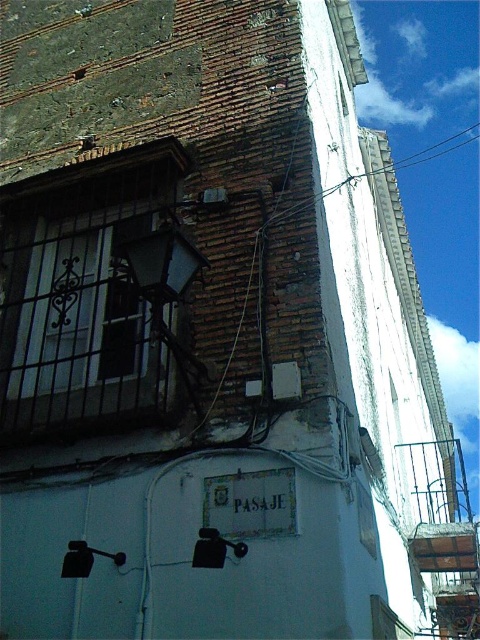
Question: Can you confirm if brown wire at center is positioned to the left of white plastic power line at upper center?

Choices:
 (A) yes
 (B) no

Answer: (B)

Question: Which point is closer to the camera?

Choices:
 (A) brown wire at center
 (B) white plastic power line at upper center

Answer: (A)

Question: Is brown wire at center positioned at the back of white plastic power line at upper center?

Choices:
 (A) yes
 (B) no

Answer: (B)

Question: Which point is closer to the camera taking this photo?

Choices:
 (A) (435, 432)
 (B) (447, 147)

Answer: (A)

Question: Which object is closer to the camera taking this photo?

Choices:
 (A) brown wire at center
 (B) white plastic power line at upper center

Answer: (A)

Question: Does brown wire at center have a greater width compared to white plastic power line at upper center?

Choices:
 (A) no
 (B) yes

Answer: (B)